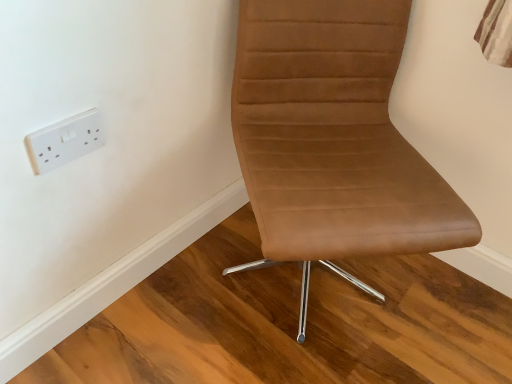
What do you see at coordinates (333, 139) in the screenshot? This screenshot has width=512, height=384. I see `suede brown chair at center` at bounding box center [333, 139].

Locate an element on the screen. suede brown chair at center is located at coordinates (333, 139).

Locate an element on the screen. The width and height of the screenshot is (512, 384). suede brown chair at center is located at coordinates click(333, 139).